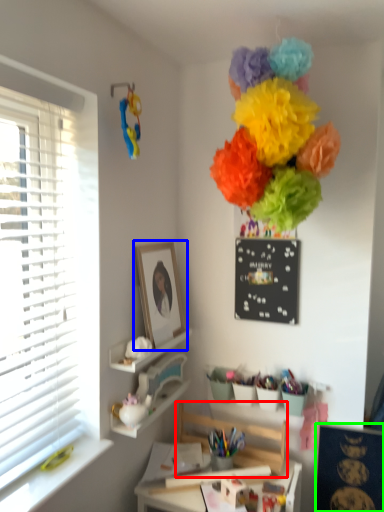
Question: Estimate the real-world distances between objects in this image. Which object is farther from swivel chair (highlighted by a red box), picture frame (highlighted by a blue box) or bulletin board (highlighted by a green box)?

Choices:
 (A) picture frame
 (B) bulletin board

Answer: (A)